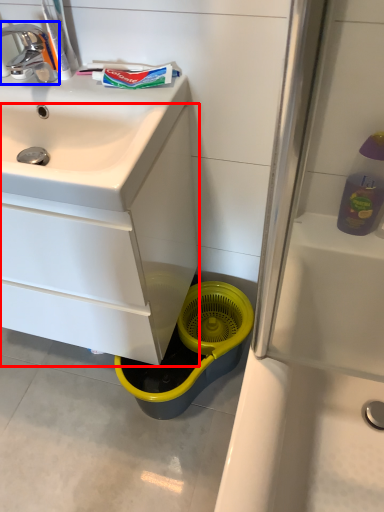
Question: Among these objects, which one is farthest to the camera, bathroom cabinet (highlighted by a red box) or tap (highlighted by a blue box)?

Choices:
 (A) bathroom cabinet
 (B) tap

Answer: (B)